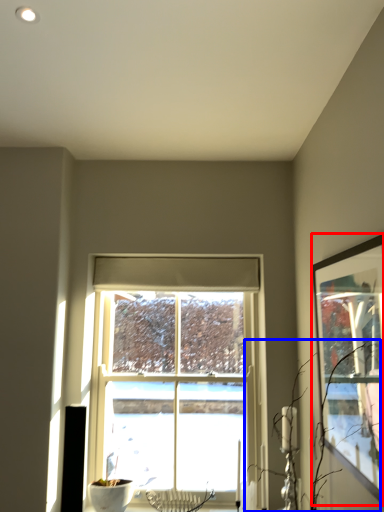
Question: Which of the following is the closest to the observer, picture frame (highlighted by a red box) or branch (highlighted by a blue box)?

Choices:
 (A) picture frame
 (B) branch

Answer: (A)